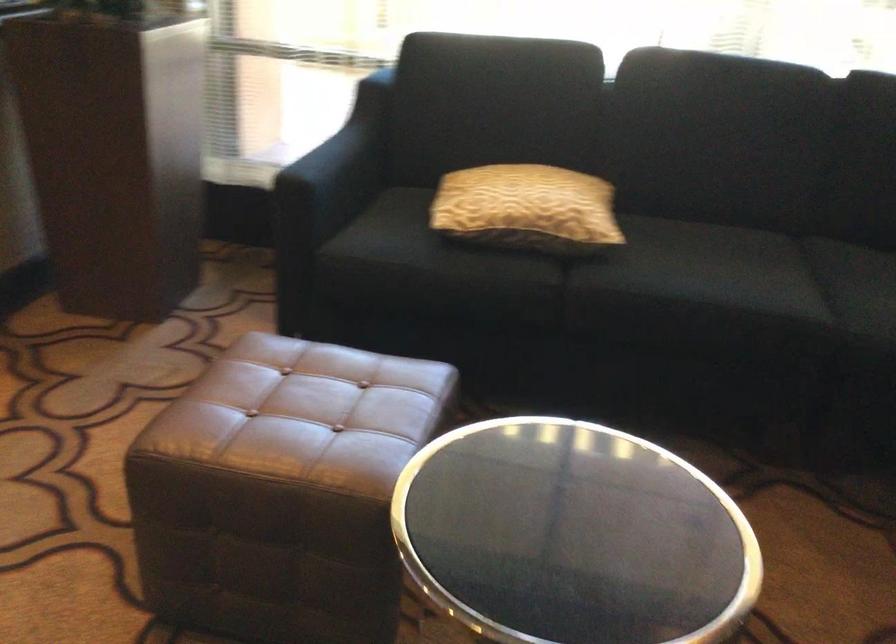
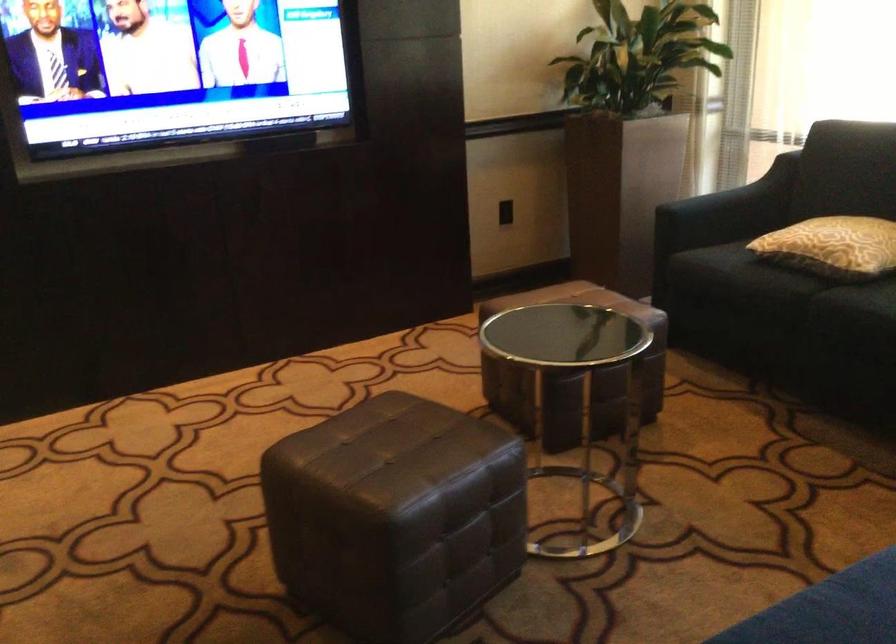
Find the pixel in the second image that matches [565,222] in the first image.

(832, 245)